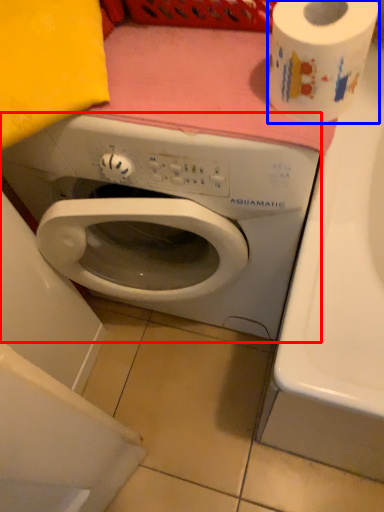
Question: Which object appears closest to the camera in this image, washing machine (highlighted by a red box) or toilet paper (highlighted by a blue box)?

Choices:
 (A) washing machine
 (B) toilet paper

Answer: (B)